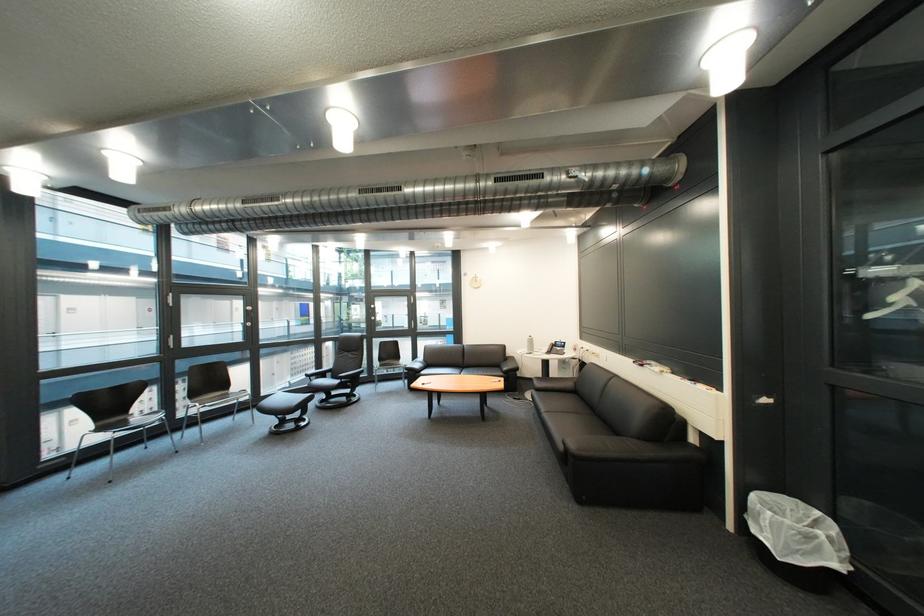
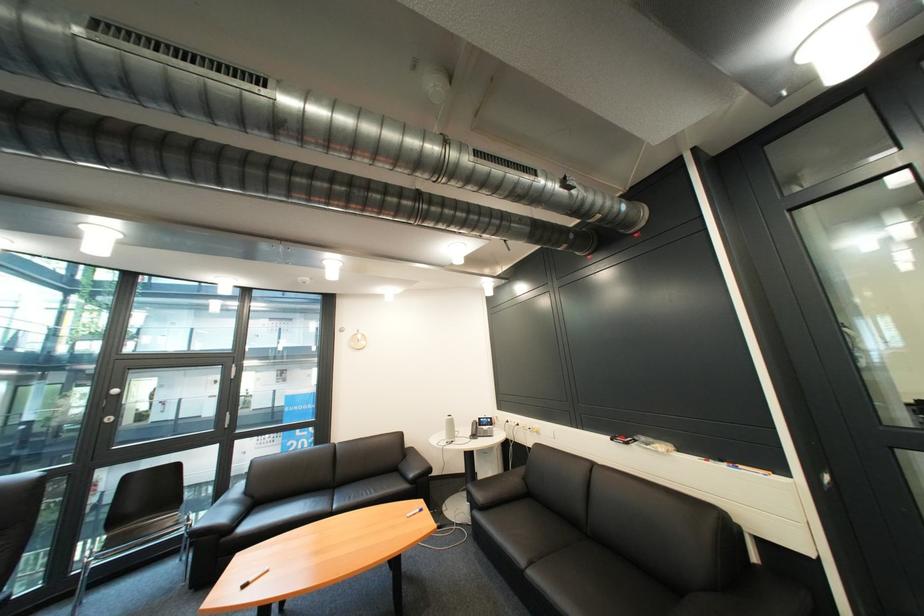
Find the pixel in the second image that matches the point at 560,418 in the first image.

(546, 577)